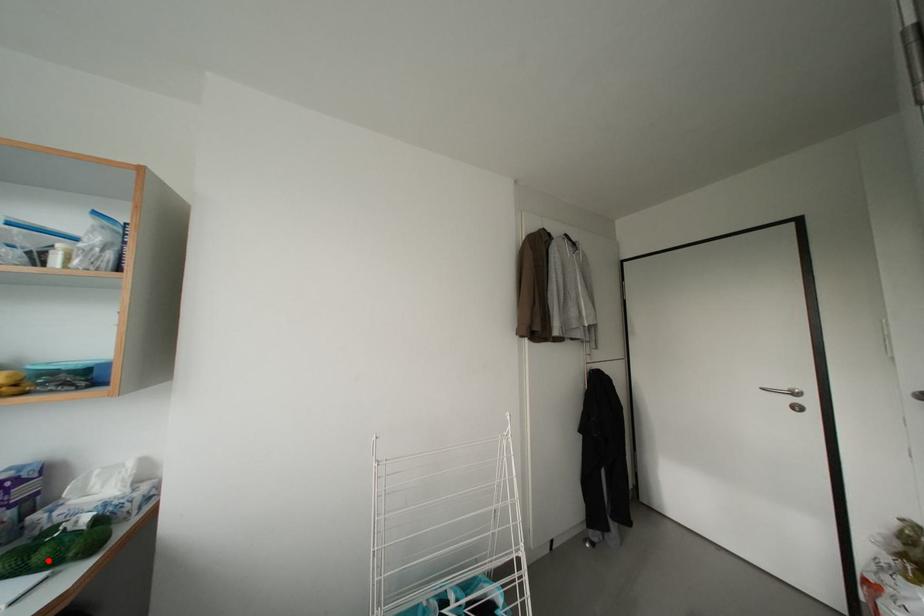
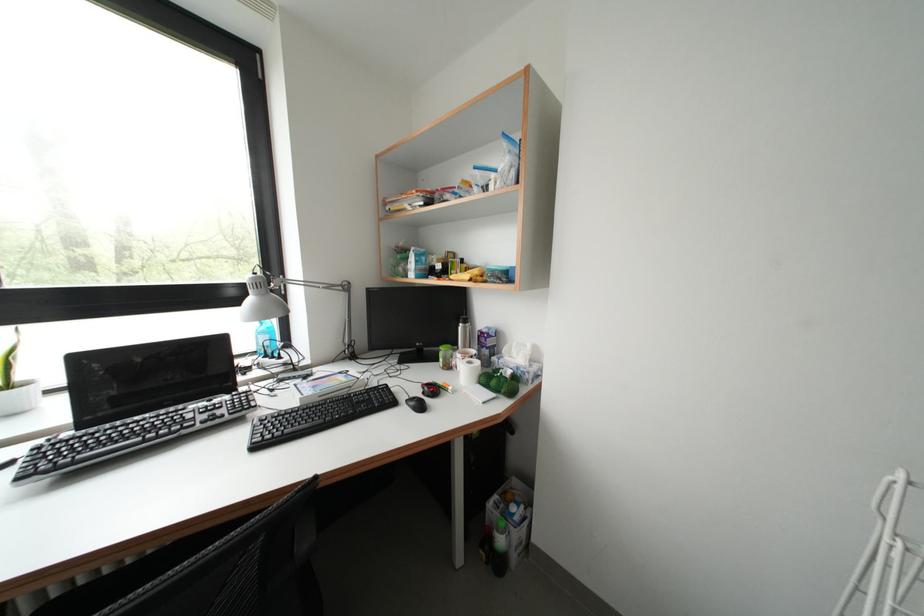
In the second image, find the point that corresponds to the highlighted location in the first image.

(500, 387)